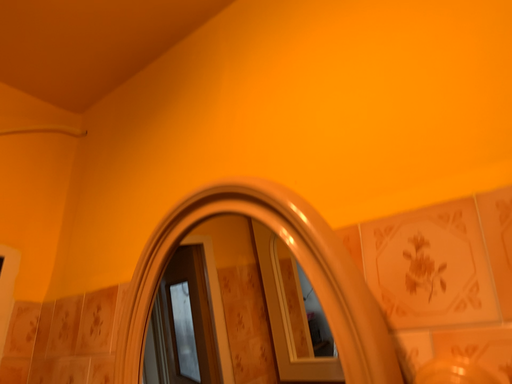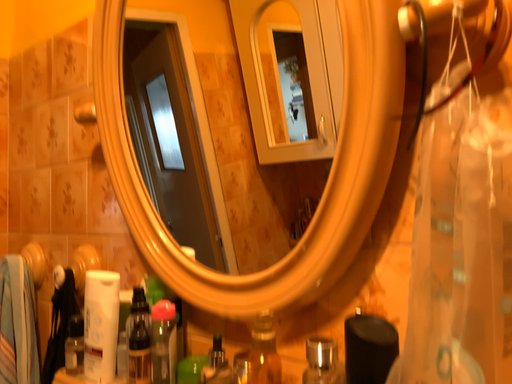
Question: How did the camera likely rotate when shooting the video?

Choices:
 (A) rotated upward
 (B) rotated downward

Answer: (B)